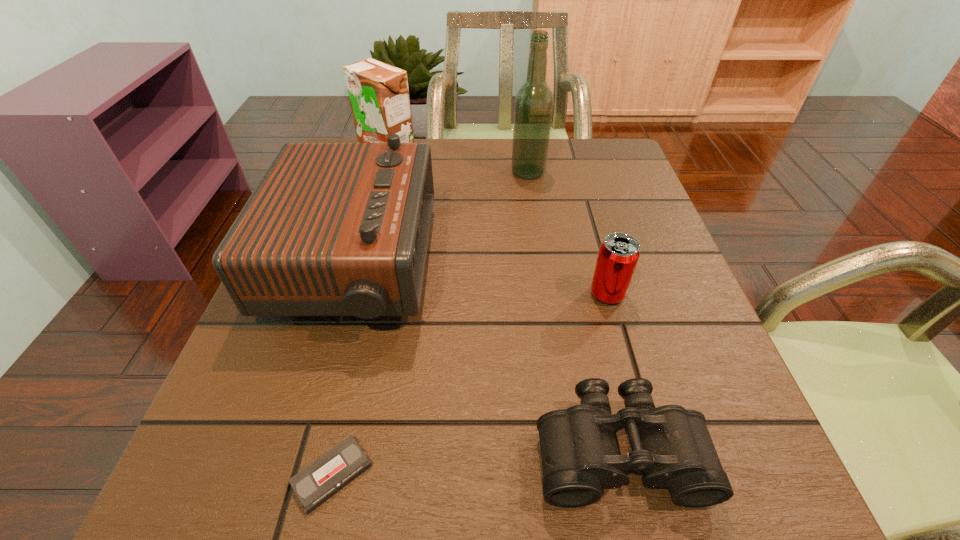
Find the location of a particular element. The image size is (960, 540). vacant space that satisfies the following two spatial constraints: 1. on the tuning display of the videotape; 2. on the right side of the radio receiver is located at coordinates (294, 475).

Locate an element on the screen. The image size is (960, 540). free space that satisfies the following two spatial constraints: 1. on the tuning display of the fourth shortest object; 2. on the left side of the videotape is located at coordinates (294, 475).

Identify the location of vacant point that satisfies the following two spatial constraints: 1. on the straw side of the carton; 2. on the right side of the shortest object. The height and width of the screenshot is (540, 960). (296, 475).

Identify the location of vacant region that satisfies the following two spatial constraints: 1. on the tuning display of the fourth shortest object; 2. on the back side of the videotape. (294, 475).